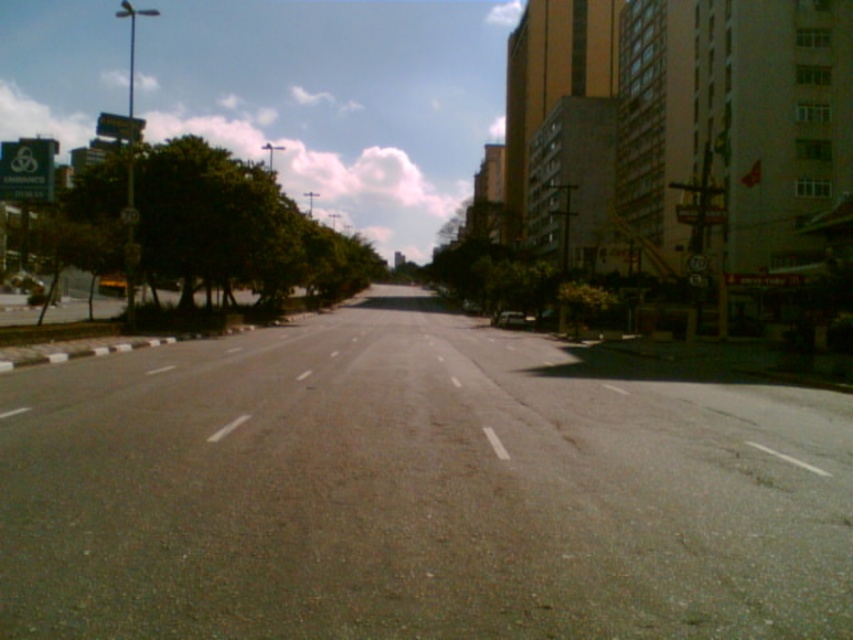
You are a pedestrian standing on the sidewalk on the left side of the road. You want to cross to the right side to enter a building. Before stepping into the road, you notice the green leafy tree at left and the metallic silver car at center. Which object is closer to you?

The green leafy tree at left is closer to you since it is on the left side where you are standing, while the metallic silver car at center is further away in the middle of the road.

You are standing at the starting point of the street and see two points marked on the road ahead. The first is at coordinates point (120, 252) and the second is at point (509, 310). Which point is nearer to your current position?

Point (120, 252) is closer to the viewer than point (509, 310), so the first point is nearer to your current position.